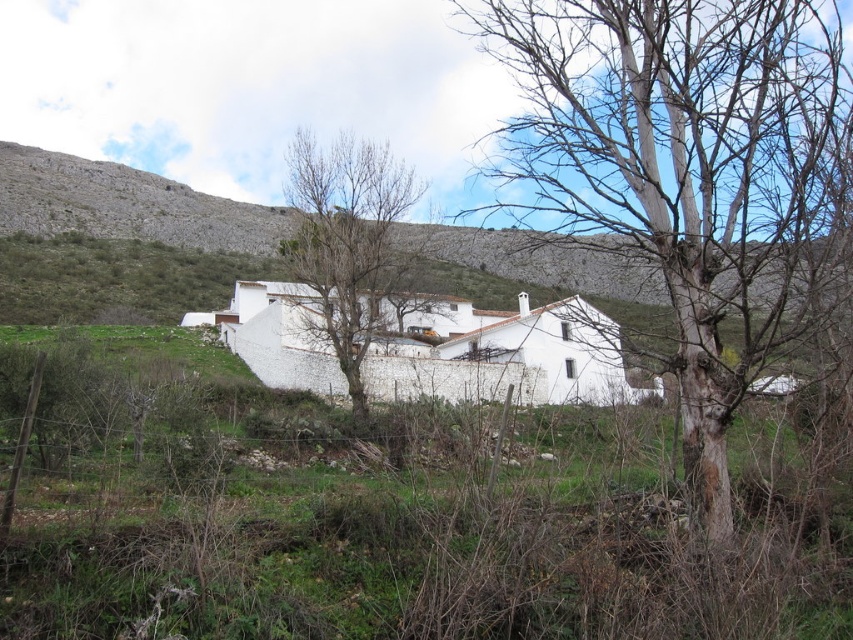
Can you confirm if white smooth hillside at center is taller than bare branches at center?

Yes, white smooth hillside at center is taller than bare branches at center.

Which is in front, point (631, 289) or point (340, 237)?

Positioned in front is point (340, 237).

Locate an element on the screen. Image resolution: width=853 pixels, height=640 pixels. white smooth hillside at center is located at coordinates tap(126, 204).

Which is below, bare wood tree at center or white smooth hillside at center?

white smooth hillside at center is lower down.

Which is more to the right, bare wood tree at center or white smooth hillside at center?

Positioned to the right is bare wood tree at center.

Who is more forward, (578,32) or (51,170)?

Point (578,32) is in front.

Locate an element on the screen. The height and width of the screenshot is (640, 853). bare wood tree at center is located at coordinates coord(682,170).

What do you see at coordinates (682, 170) in the screenshot?
I see `bare wood tree at center` at bounding box center [682, 170].

Who is positioned more to the left, bare wood tree at center or bare branches at center?

Positioned to the left is bare branches at center.

Who is more forward, (x=750, y=316) or (x=376, y=291)?

Point (x=750, y=316)

The height and width of the screenshot is (640, 853). I want to click on bare wood tree at center, so click(x=682, y=170).